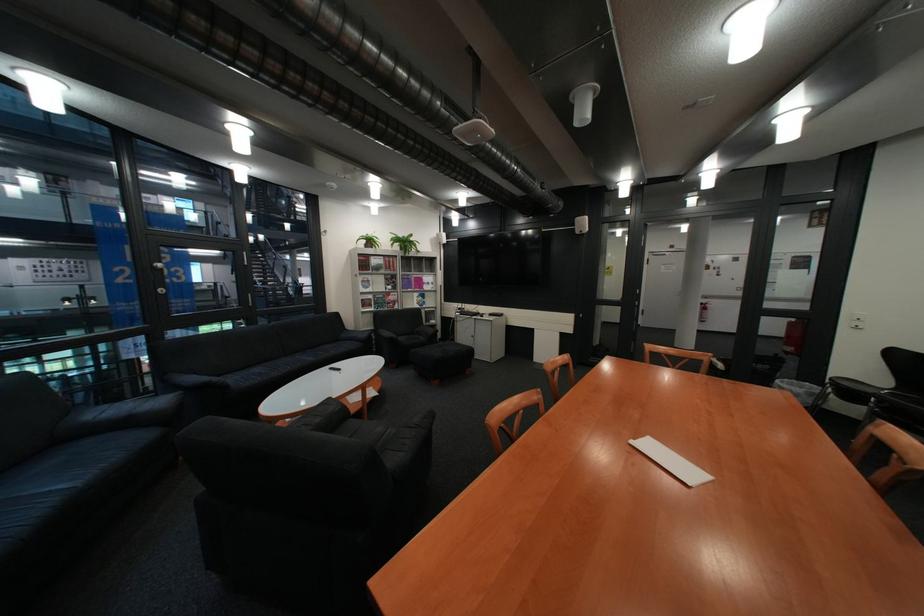
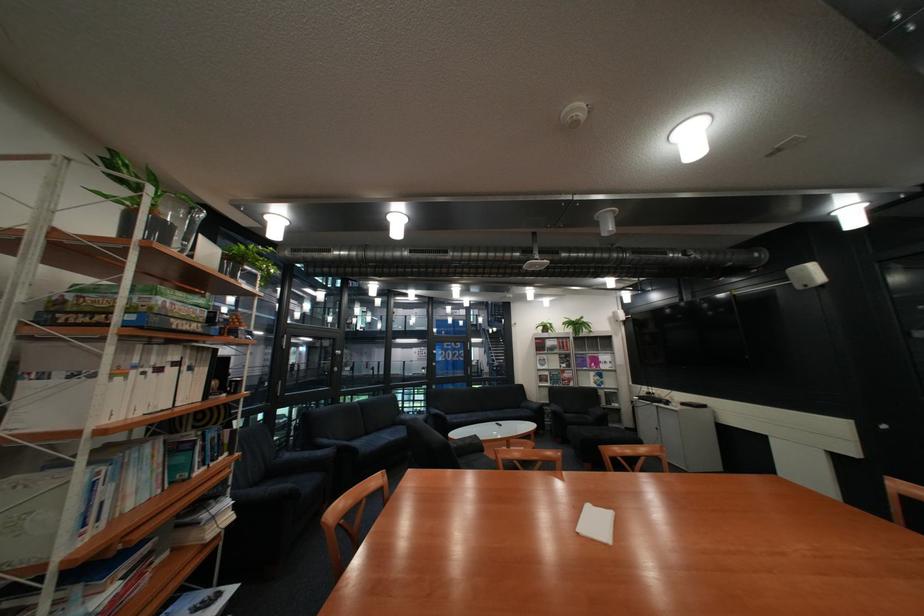
The point at (x=354, y=341) is marked in the first image. Where is the corresponding point in the second image?

(535, 408)